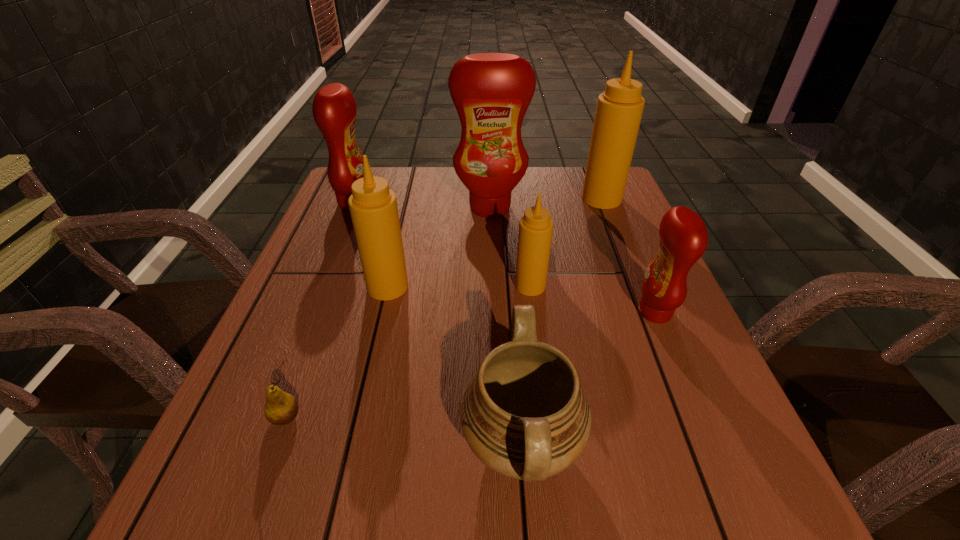
This screenshot has height=540, width=960. I want to click on free space located 0.270m on the front-facing side of the urn, so click(x=284, y=444).

At what (x,y) coordinates should I click in order to perform the action: click on free point located 0.160m on the front-facing side of the urn. Please return your answer as a coordinate pair (x, y). Image resolution: width=960 pixels, height=540 pixels. Looking at the image, I should click on (356, 444).

Locate an element on the screen. blank space located 0.080m on the front-facing side of the urn is located at coordinates (409, 444).

Find the location of `vacant region located on the back of the pear`. vacant region located on the back of the pear is located at coordinates [x=344, y=262].

This screenshot has height=540, width=960. Identify the location of object situated at the near edge. (524, 414).

Identify the location of condiment that is at the left edge. (x=334, y=109).

Identify the location of pear at the left edge. (281, 408).

At what (x,y) coordinates should I click in order to perform the action: click on object positioned at the far left corner. Please return your answer as a coordinate pair (x, y). The height and width of the screenshot is (540, 960). Looking at the image, I should click on (334, 109).

This screenshot has width=960, height=540. Identify the location of object present at the far right corner. (619, 110).

Where is `vacant space at the far edge of the desktop`? vacant space at the far edge of the desktop is located at coordinates (521, 208).